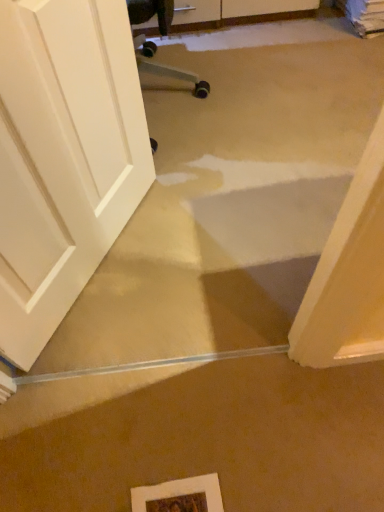
Question: Is white matte door at left closer to the viewer compared to white matte picture frame at lower center?

Choices:
 (A) yes
 (B) no

Answer: (A)

Question: Is white matte door at left to the right of white matte picture frame at lower center from the viewer's perspective?

Choices:
 (A) no
 (B) yes

Answer: (A)

Question: Considering the relative positions of white matte door at left and white matte picture frame at lower center in the image provided, is white matte door at left to the left of white matte picture frame at lower center from the viewer's perspective?

Choices:
 (A) no
 (B) yes

Answer: (B)

Question: Considering the relative sizes of white matte door at left and white matte picture frame at lower center in the image provided, is white matte door at left bigger than white matte picture frame at lower center?

Choices:
 (A) no
 (B) yes

Answer: (B)

Question: Considering the relative sizes of white matte door at left and white matte picture frame at lower center in the image provided, is white matte door at left shorter than white matte picture frame at lower center?

Choices:
 (A) no
 (B) yes

Answer: (A)

Question: From a real-world perspective, does white matte door at left stand above white matte picture frame at lower center?

Choices:
 (A) no
 (B) yes

Answer: (B)

Question: Is white matte picture frame at lower center smaller than white matte door at left?

Choices:
 (A) yes
 (B) no

Answer: (A)

Question: Does white matte picture frame at lower center have a lesser height compared to white matte door at left?

Choices:
 (A) no
 (B) yes

Answer: (B)

Question: Is white matte picture frame at lower center positioned before white matte door at left?

Choices:
 (A) yes
 (B) no

Answer: (B)

Question: Does white matte picture frame at lower center turn towards white matte door at left?

Choices:
 (A) yes
 (B) no

Answer: (B)

Question: Is white matte picture frame at lower center turned away from white matte door at left?

Choices:
 (A) no
 (B) yes

Answer: (A)

Question: Is white matte picture frame at lower center taller than white matte door at left?

Choices:
 (A) no
 (B) yes

Answer: (A)

Question: Would you say white matte picture frame at lower center is inside or outside white matte door at left?

Choices:
 (A) inside
 (B) outside

Answer: (B)